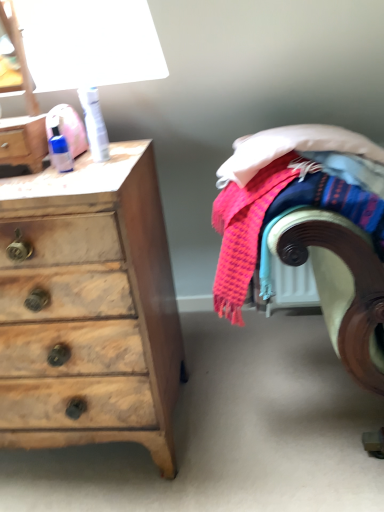
At what (x,y) coordinates should I click in order to perform the action: click on free point above matte plastic bottle at upper left (from a real-world perspective). Please return your answer as a coordinate pair (x, y). Image resolution: width=384 pixels, height=512 pixels. Looking at the image, I should click on (22, 117).